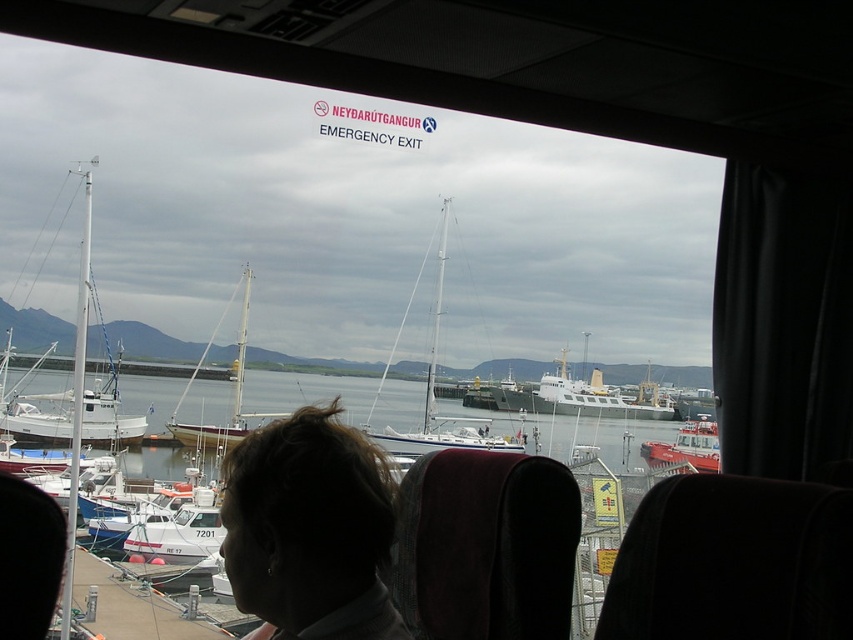
Consider the image. How much distance is there between white matte sailboat at left and white wooden sailboat at center?

The distance of white matte sailboat at left from white wooden sailboat at center is 6.66 meters.

Is white matte sailboat at left shorter than white wooden sailboat at center?

No, white matte sailboat at left is not shorter than white wooden sailboat at center.

Who is more distant from viewer, (86,234) or (167,428)?

Positioned behind is point (167,428).

Where is `white matte sailboat at left`? white matte sailboat at left is located at coordinates (x=74, y=376).

Which of these two, white matte sailboat at center or white wooden sailboat at center, stands taller?

white matte sailboat at center

Is point (476, 440) positioned after point (242, 346)?

No, (476, 440) is closer to viewer.

Where is `white matte sailboat at center`? This screenshot has height=640, width=853. white matte sailboat at center is located at coordinates (433, 387).

Is dark brown hair at center below red rubber dinghy at lower right?

Actually, dark brown hair at center is above red rubber dinghy at lower right.

Can you confirm if dark brown hair at center is taller than red rubber dinghy at lower right?

In fact, dark brown hair at center may be shorter than red rubber dinghy at lower right.

Who is more forward, (335, 509) or (682, 456)?

Point (335, 509)

At what (x,y) coordinates should I click in order to perform the action: click on dark brown hair at center. Please return your answer as a coordinate pair (x, y). Looking at the image, I should click on (309, 529).